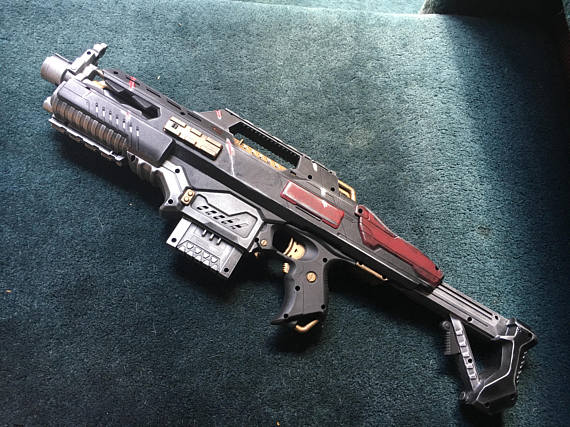
Where is `handle`? handle is located at coordinates (306, 164).